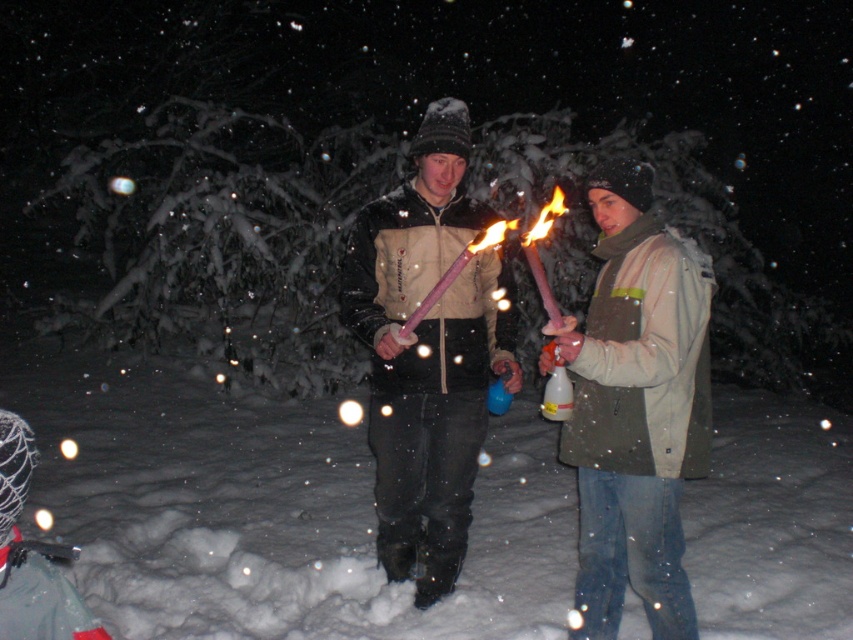
You are a photographer trying to capture the scene with the white fluffy snow at center and the khaki fabric jacket at center. Which object should you focus on first to ensure it appears sharp in your photo?

You should focus on the khaki fabric jacket at center first because it is closer to you than the white fluffy snow at center, which is further away.

You are a photographer trying to capture the scene. You notice the matte pink torch at center and the matte beige vest at center. Which object is positioned lower in the image?

The matte pink torch at center is below the matte beige vest at center, so the matte pink torch at center is positioned lower in the image.

Consider the image. You are standing in the snowy area and want to place a small flag exactly at the center of the white fluffy snow at center. According to the coordinates provided, where should you place the flag?

You should place the flag at the coordinates point (273,513) where the white fluffy snow at center is located.